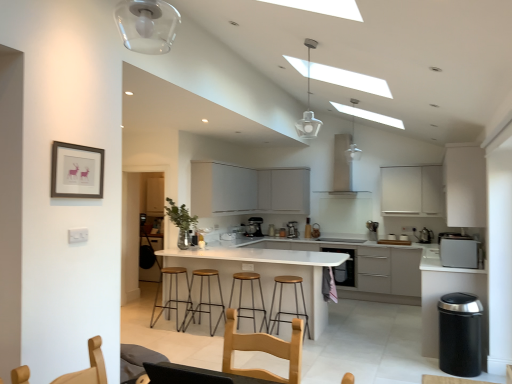
Question: Is satin silver microwave at right directly adjacent to brown leather bar stool at center, the 4th bar stool from the right?

Choices:
 (A) yes
 (B) no

Answer: (B)

Question: From a real-world perspective, is satin silver microwave at right over brown leather bar stool at center, the 4th bar stool from the right?

Choices:
 (A) no
 (B) yes

Answer: (B)

Question: Can you confirm if satin silver microwave at right is shorter than brown leather bar stool at center, the 4th bar stool from the right?

Choices:
 (A) yes
 (B) no

Answer: (A)

Question: Considering the relative sizes of satin silver microwave at right and brown leather bar stool at center, the 4th bar stool from the right, in the image provided, is satin silver microwave at right taller than brown leather bar stool at center, the 4th bar stool from the right,?

Choices:
 (A) no
 (B) yes

Answer: (A)

Question: From the image's perspective, is satin silver microwave at right above brown leather bar stool at center, the 4th bar stool from the right?

Choices:
 (A) no
 (B) yes

Answer: (B)

Question: Is satin silver coffee machine at center, acting as the first coffee machine starting from the front, wider or thinner than satin silver kettle at right, marked as the 3th appliance in a left-to-right arrangement?

Choices:
 (A) thin
 (B) wide

Answer: (B)

Question: From the image's perspective, is satin silver coffee machine at center, acting as the first coffee machine starting from the front, located above or below satin silver kettle at right, the 1th appliance viewed from the front?

Choices:
 (A) below
 (B) above

Answer: (B)

Question: Looking at the image, does satin silver coffee machine at center, placed as the first coffee machine when sorted from right to left, seem bigger or smaller compared to satin silver kettle at right, which ranks as the 3th appliance in back-to-front order?

Choices:
 (A) big
 (B) small

Answer: (A)

Question: From their relative heights in the image, would you say satin silver coffee machine at center, placed as the first coffee machine when sorted from right to left, is taller or shorter than satin silver kettle at right, which ranks as the 3th appliance in back-to-front order?

Choices:
 (A) tall
 (B) short

Answer: (A)

Question: In terms of height, does satin silver coffee machine at center, acting as the first coffee machine starting from the front, look taller or shorter compared to satin silver coffee machine at center, marked as the third coffee machine in a front-to-back arrangement?

Choices:
 (A) tall
 (B) short

Answer: (B)

Question: From the image's perspective, relative to satin silver coffee machine at center, which ranks as the first coffee machine in back-to-front order, is satin silver coffee machine at center, acting as the first coffee machine starting from the front, above or below?

Choices:
 (A) above
 (B) below

Answer: (B)

Question: Looking at their shapes, would you say satin silver coffee machine at center, placed as the first coffee machine when sorted from right to left, is wider or thinner than satin silver coffee machine at center, which ranks as the first coffee machine in back-to-front order?

Choices:
 (A) thin
 (B) wide

Answer: (A)

Question: Visually, is satin silver coffee machine at center, positioned as the 3th coffee machine in left-to-right order, positioned to the left or to the right of satin silver coffee machine at center, marked as the third coffee machine in a front-to-back arrangement?

Choices:
 (A) left
 (B) right

Answer: (B)

Question: Looking at the image, does brown leather bar stool at center, the 4th bar stool from the right, seem bigger or smaller compared to wooden seat bar stool at center, acting as the third bar stool starting from the right?

Choices:
 (A) small
 (B) big

Answer: (B)

Question: From the image's perspective, is brown leather bar stool at center, the 4th bar stool from the right, located above or below wooden seat bar stool at center, placed as the 2th bar stool when sorted from left to right?

Choices:
 (A) above
 (B) below

Answer: (B)